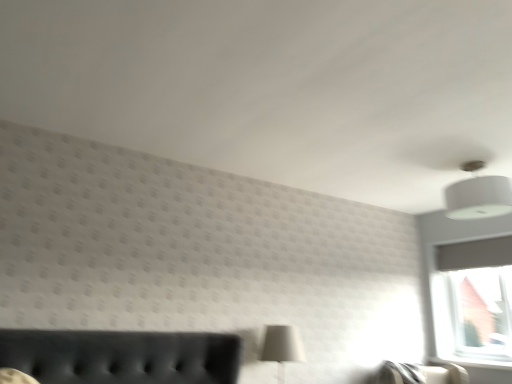
Question: Is white matte table lamp at lower center surrounded by white glossy window sill at lower right?

Choices:
 (A) yes
 (B) no

Answer: (B)

Question: Does white glossy window sill at lower right have a lesser width compared to white matte table lamp at lower center?

Choices:
 (A) no
 (B) yes

Answer: (B)

Question: Does white glossy window sill at lower right have a lesser height compared to white matte table lamp at lower center?

Choices:
 (A) yes
 (B) no

Answer: (A)

Question: Is white glossy window sill at lower right positioned in front of white matte table lamp at lower center?

Choices:
 (A) yes
 (B) no

Answer: (B)

Question: Is white glossy window sill at lower right further to the viewer compared to white matte table lamp at lower center?

Choices:
 (A) yes
 (B) no

Answer: (A)

Question: Is the surface of white glossy window sill at lower right in direct contact with white matte table lamp at lower center?

Choices:
 (A) yes
 (B) no

Answer: (B)

Question: Is white fabric lampshade at upper right shorter than white glossy window sill at lower right?

Choices:
 (A) no
 (B) yes

Answer: (A)

Question: Can you confirm if white fabric lampshade at upper right is positioned to the right of white glossy window sill at lower right?

Choices:
 (A) yes
 (B) no

Answer: (B)

Question: Are white fabric lampshade at upper right and white glossy window sill at lower right far apart?

Choices:
 (A) no
 (B) yes

Answer: (B)

Question: Can you confirm if white fabric lampshade at upper right is thinner than white glossy window sill at lower right?

Choices:
 (A) yes
 (B) no

Answer: (B)

Question: Does white fabric lampshade at upper right come in front of white glossy window sill at lower right?

Choices:
 (A) no
 (B) yes

Answer: (B)

Question: Can you confirm if white fabric lampshade at upper right is positioned to the left of white glossy window sill at lower right?

Choices:
 (A) yes
 (B) no

Answer: (A)

Question: Is the position of white fabric lampshade at upper right more distant than that of white matte table lamp at lower center?

Choices:
 (A) no
 (B) yes

Answer: (A)